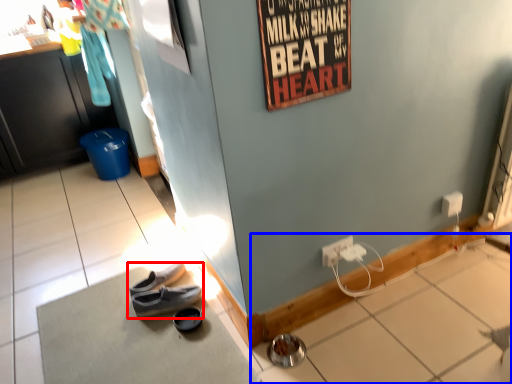
Question: Which point is closer to the camera, footwear (highlighted by a red box) or tile (highlighted by a blue box)?

Choices:
 (A) footwear
 (B) tile

Answer: (B)